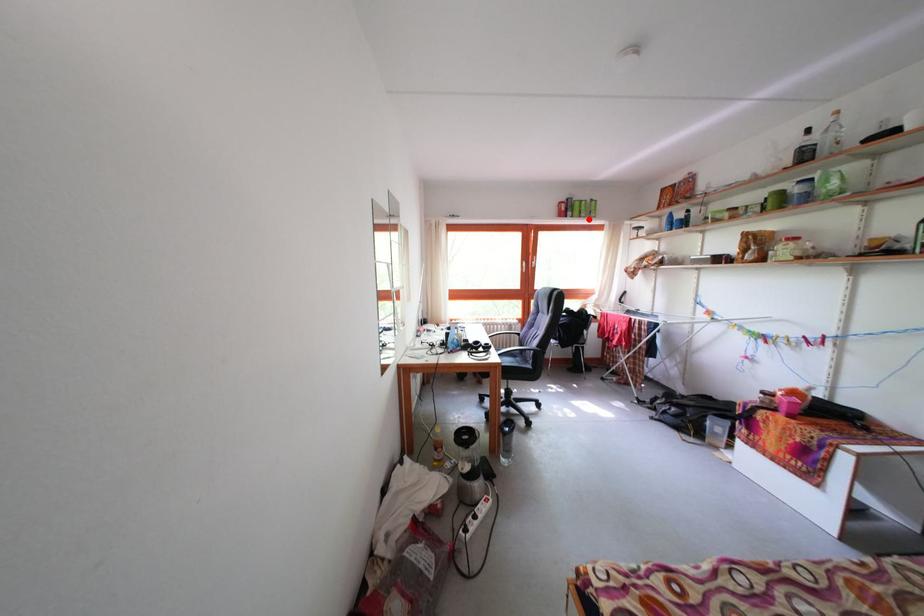
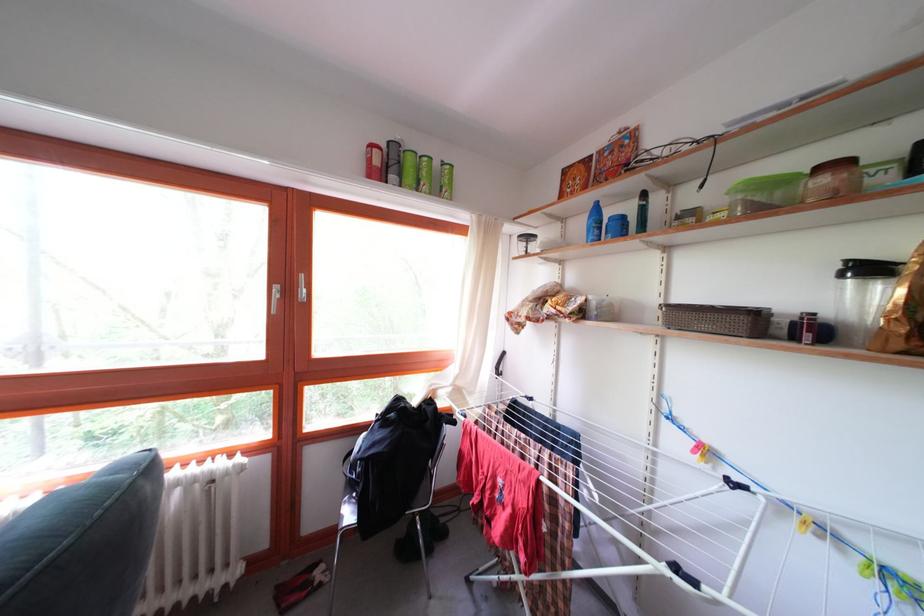
Find the pixel in the second image that matches the highlighted location in the first image.

(428, 187)